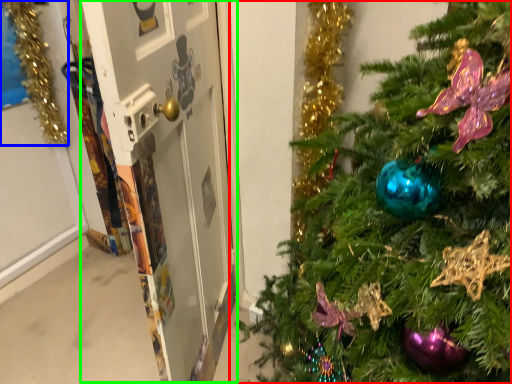
Question: Based on their relative distances, which object is nearer to christmas tree (highlighted by a red box)? Choose from christmas decoration (highlighted by a blue box) and screen door (highlighted by a green box).

Choices:
 (A) christmas decoration
 (B) screen door

Answer: (B)